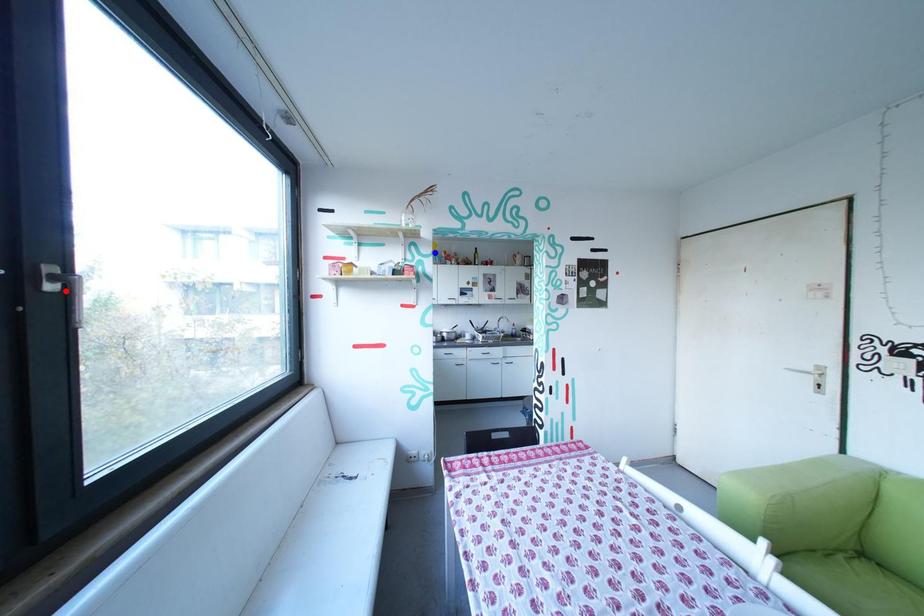
Question: Which of the two points in the image is closer to the camera?

Choices:
 (A) Blue point is closer.
 (B) Red point is closer.

Answer: (B)